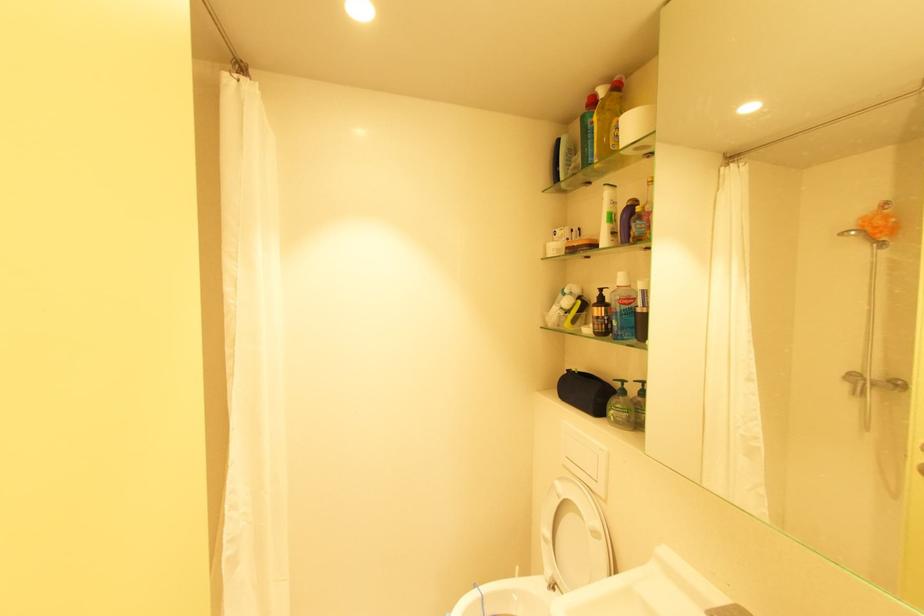
This screenshot has height=616, width=924. I want to click on brown pump dispenser head, so click(x=603, y=292).